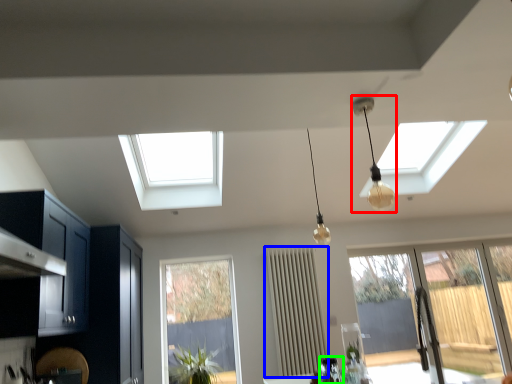
Question: Which is nearer to the lamp (highlighted by a red box)? curtain (highlighted by a blue box) or appliance (highlighted by a green box).

Choices:
 (A) curtain
 (B) appliance

Answer: (A)